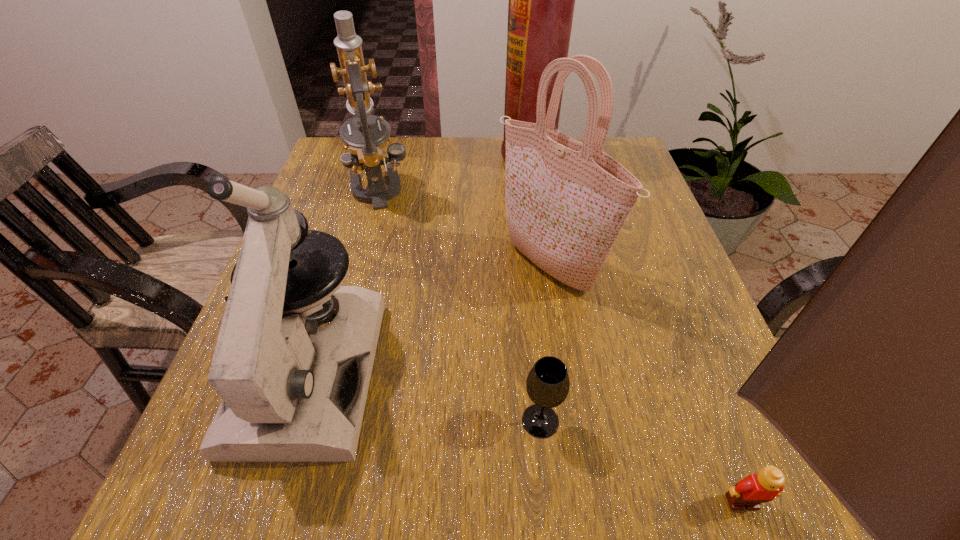
At what (x,y) coordinates should I click in order to perform the action: click on the tallest object. Please return your answer as a coordinate pair (x, y). Looking at the image, I should click on (541, 4).

At what (x,y) coordinates should I click in order to perform the action: click on shopping bag. Please return your answer as a coordinate pair (x, y). The width and height of the screenshot is (960, 540). Looking at the image, I should click on (566, 202).

I want to click on the farther microscope, so click(x=366, y=148).

At what (x,y) coordinates should I click in order to perform the action: click on the nearer microscope. Please return your answer as a coordinate pair (x, y). This screenshot has width=960, height=540. Looking at the image, I should click on (291, 392).

You are a GUI agent. You are given a task and a screenshot of the screen. Output one action in this format:
    pyautogui.click(x=<x>, y=<y>)
    Task: Click on the wineglass
    This screenshot has height=540, width=960.
    Given the screenshot: What is the action you would take?
    pyautogui.click(x=547, y=384)

Locate an element on the screen. the rightmost object is located at coordinates (750, 492).

The height and width of the screenshot is (540, 960). Identify the location of Lego. (750, 492).

Image resolution: width=960 pixels, height=540 pixels. What are the coordinates of `vacant area situated 0.160m on the side of the fire extinguisher with the label` in the screenshot? It's located at click(441, 156).

Image resolution: width=960 pixels, height=540 pixels. In order to click on vacant space situated on the side of the fire extinguisher with the label in this screenshot , I will do `click(441, 156)`.

You are a GUI agent. You are given a task and a screenshot of the screen. Output one action in this format:
    pyautogui.click(x=<x>, y=<y>)
    Task: Click on the vacant space positioned on the side of the fire extinguisher with the label
    
    Given the screenshot: What is the action you would take?
    pyautogui.click(x=474, y=156)